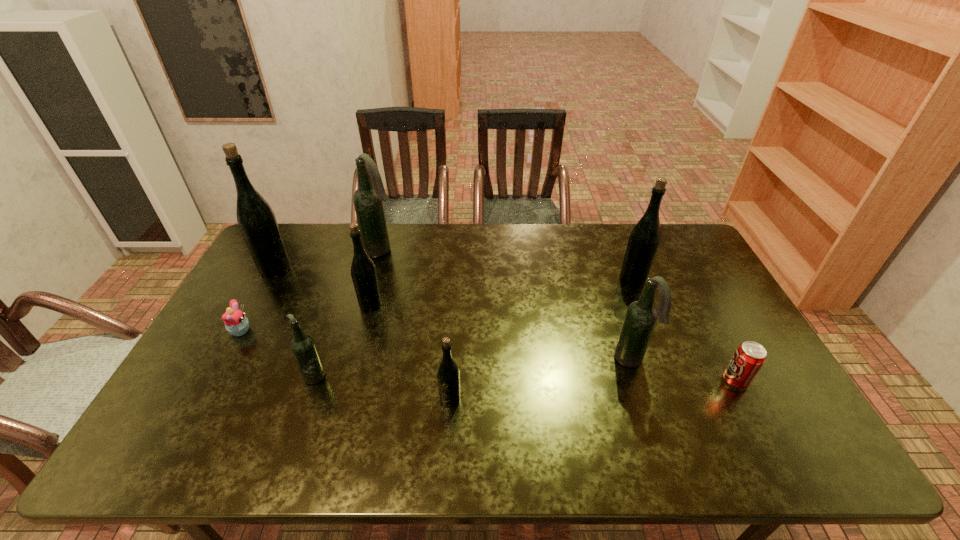
Image resolution: width=960 pixels, height=540 pixels. Find the location of `free space at the near edge of the desktop`. free space at the near edge of the desktop is located at coordinates (537, 440).

Identify the location of free space at the left edge of the desktop. (274, 307).

Where is `free space at the right edge`? free space at the right edge is located at coordinates (731, 349).

This screenshot has width=960, height=540. In the image, there is a desktop. Identify the location of vacant space at the near right corner. (788, 453).

The height and width of the screenshot is (540, 960). I want to click on empty space between the biggest dark beer bottle and the nearest beer bottle, so click(x=416, y=325).

Locate an element on the screen. This screenshot has height=540, width=960. free space that is in between the sixth beer bottle from left to right and the leftmost beer bottle is located at coordinates (453, 314).

You are a GUI agent. You are given a task and a screenshot of the screen. Output one action in this format:
    pyautogui.click(x=<x>, y=<y>)
    Task: Click on the free area in between the rightmost dark beer bottle and the tallest beer bottle
    This screenshot has height=540, width=960.
    Given the screenshot: What is the action you would take?
    pyautogui.click(x=453, y=314)

The height and width of the screenshot is (540, 960). I want to click on free space between the smallest dark beer bottle and the eighth object from left to right, so click(473, 327).

The width and height of the screenshot is (960, 540). Find the location of `free space between the sixth beer bottle from left to right and the third beer bottle from right to left`. free space between the sixth beer bottle from left to right and the third beer bottle from right to left is located at coordinates (540, 379).

The width and height of the screenshot is (960, 540). Find the location of `free space between the fifth nearest object and the second shortest object`. free space between the fifth nearest object and the second shortest object is located at coordinates (488, 356).